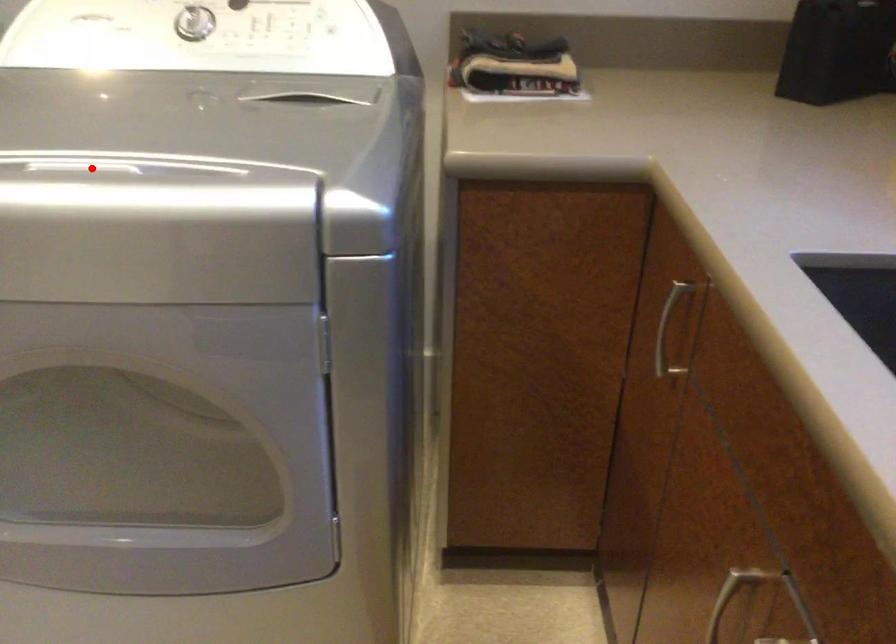
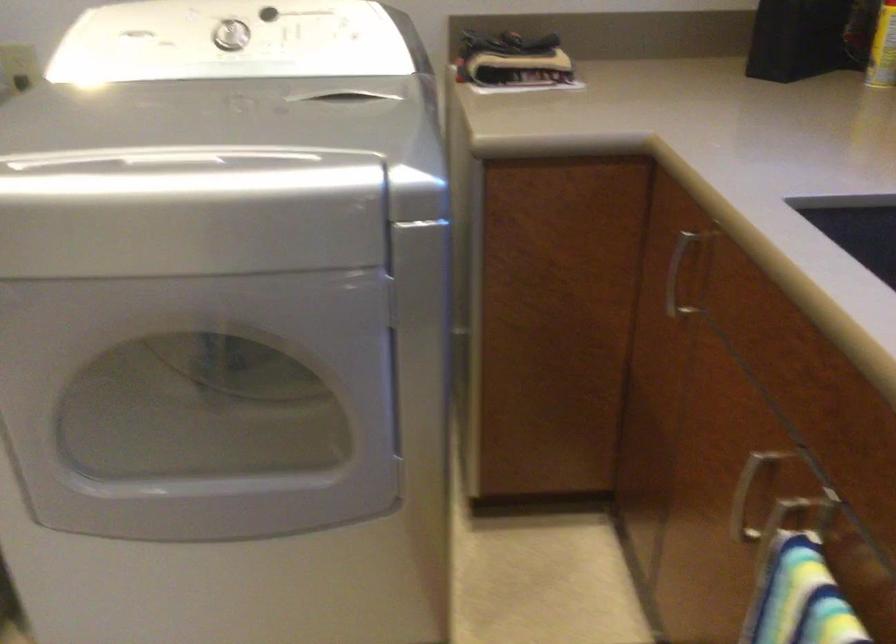
Question: I am providing you with two images of the same scene from different viewpoints. A red point is shown in image1. For the corresponding object point in image2, is it positioned nearer or farther from the camera?

Choices:
 (A) Nearer
 (B) Farther

Answer: (B)